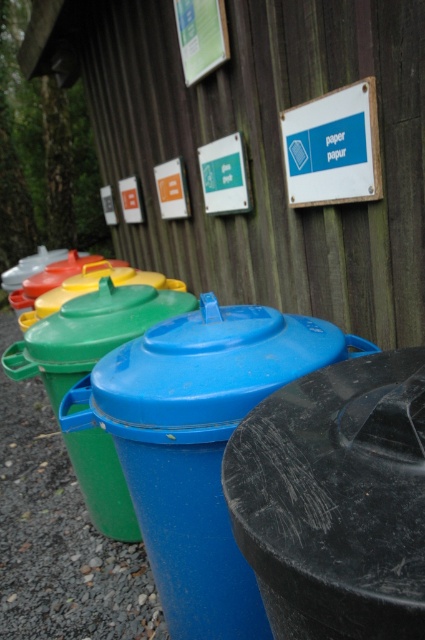
Question: Which of these objects is positioned farthest from the green matte lid at center?

Choices:
 (A) blue plastic sign at upper center
 (B) blue plastic bin at center

Answer: (B)

Question: Considering the relative positions of blue plastic sign at upper center and green matte lid at center in the image provided, where is blue plastic sign at upper center located with respect to green matte lid at center?

Choices:
 (A) above
 (B) below

Answer: (A)

Question: Can you confirm if blue plastic sign at upper center is positioned below green matte lid at center?

Choices:
 (A) no
 (B) yes

Answer: (A)

Question: Can you confirm if blue plastic bin at center is smaller than blue plastic sign at upper center?

Choices:
 (A) no
 (B) yes

Answer: (A)

Question: Which point is closer to the camera taking this photo?

Choices:
 (A) (149, 285)
 (B) (99, 634)
 (C) (377, 196)

Answer: (C)

Question: Which of the following is the farthest from the observer?

Choices:
 (A) (84, 337)
 (B) (8, 385)

Answer: (B)